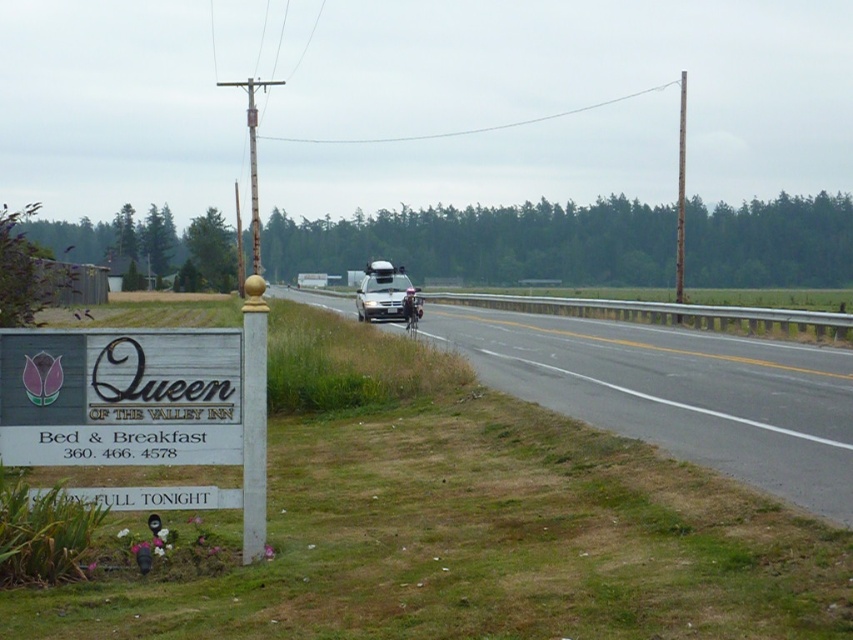
Question: Does asphalt road at center have a lesser width compared to white matte van at center?

Choices:
 (A) no
 (B) yes

Answer: (A)

Question: Based on their relative distances, which object is nearer to the white matte van at center?

Choices:
 (A) brushed metal utility pole at upper center
 (B) wooden signboard at lower left
 (C) asphalt road at center

Answer: (C)

Question: Does asphalt road at center appear on the left side of white matte van at center?

Choices:
 (A) no
 (B) yes

Answer: (A)

Question: Which point appears closest to the camera in this image?

Choices:
 (A) (396, 266)
 (B) (122, 360)

Answer: (B)

Question: Which point is farther to the camera?

Choices:
 (A) asphalt road at center
 (B) white matte van at center
 (C) brushed metal utility pole at upper center
 (D) wooden signboard at lower left

Answer: (C)

Question: Can you confirm if white matte van at center is wider than brushed metal utility pole at upper center?

Choices:
 (A) no
 (B) yes

Answer: (A)